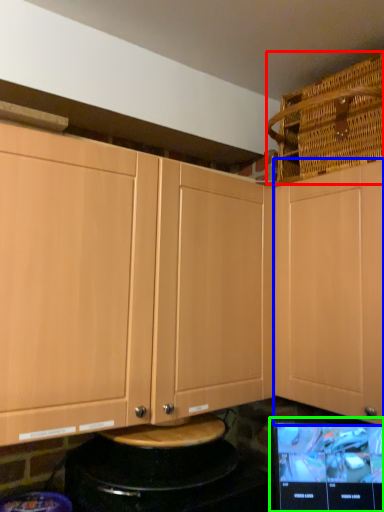
Question: Considering the real-world distances, which object is closest to basket (highlighted by a red box)? cabinetry (highlighted by a blue box) or computer monitor (highlighted by a green box).

Choices:
 (A) cabinetry
 (B) computer monitor

Answer: (A)